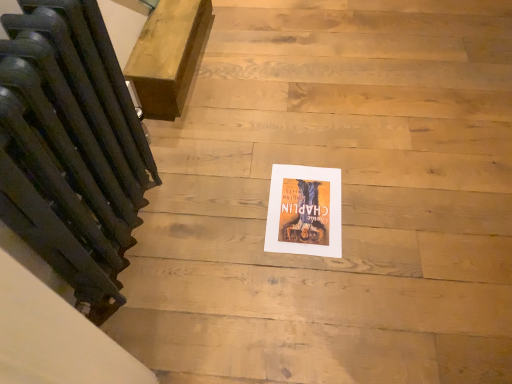
Question: Should I look upward or downward to see matte paper poster at center?

Choices:
 (A) up
 (B) down

Answer: (B)

Question: Does matte black radiator at left have a greater height compared to matte paper poster at center?

Choices:
 (A) yes
 (B) no

Answer: (A)

Question: Can you see matte black radiator at left touching matte paper poster at center?

Choices:
 (A) no
 (B) yes

Answer: (A)

Question: From a real-world perspective, is matte black radiator at left physically below matte paper poster at center?

Choices:
 (A) no
 (B) yes

Answer: (A)

Question: From the image's perspective, does matte black radiator at left appear higher than matte paper poster at center?

Choices:
 (A) no
 (B) yes

Answer: (B)

Question: From a real-world perspective, is matte black radiator at left physically above matte paper poster at center?

Choices:
 (A) no
 (B) yes

Answer: (B)

Question: Could matte paper poster at center be considered to be inside matte black radiator at left?

Choices:
 (A) yes
 (B) no

Answer: (B)

Question: Is matte paper poster at center further to camera compared to wooden bench at upper left?

Choices:
 (A) yes
 (B) no

Answer: (B)

Question: From the image's perspective, would you say matte paper poster at center is shown under wooden bench at upper left?

Choices:
 (A) no
 (B) yes

Answer: (B)

Question: Does matte paper poster at center appear on the left side of wooden bench at upper left?

Choices:
 (A) yes
 (B) no

Answer: (B)

Question: Can you confirm if matte paper poster at center is wider than wooden bench at upper left?

Choices:
 (A) no
 (B) yes

Answer: (A)

Question: Does matte paper poster at center have a lesser height compared to wooden bench at upper left?

Choices:
 (A) yes
 (B) no

Answer: (A)

Question: Is matte paper poster at center facing towards wooden bench at upper left?

Choices:
 (A) yes
 (B) no

Answer: (B)

Question: From the image's perspective, does matte paper poster at center appear higher than matte black radiator at left?

Choices:
 (A) yes
 (B) no

Answer: (B)